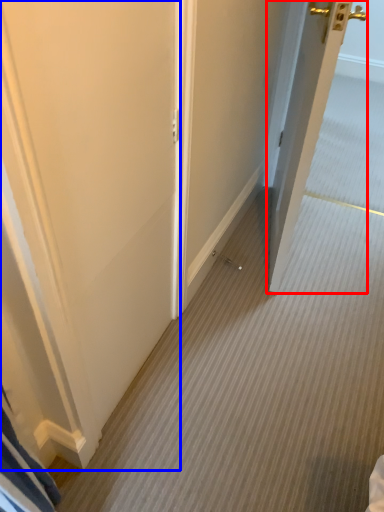
Question: Among these objects, which one is nearest to the camera, door (highlighted by a red box) or door (highlighted by a blue box)?

Choices:
 (A) door
 (B) door

Answer: (B)